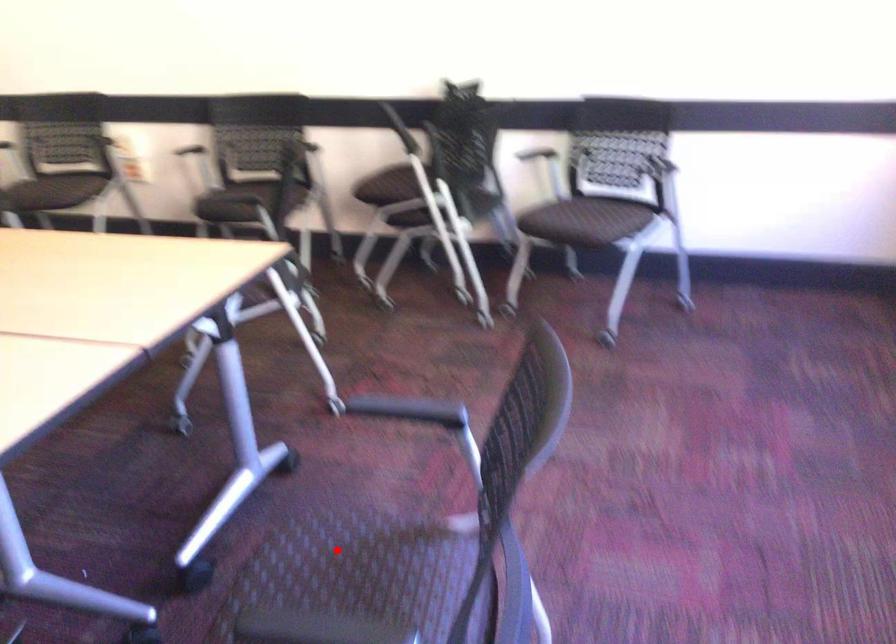
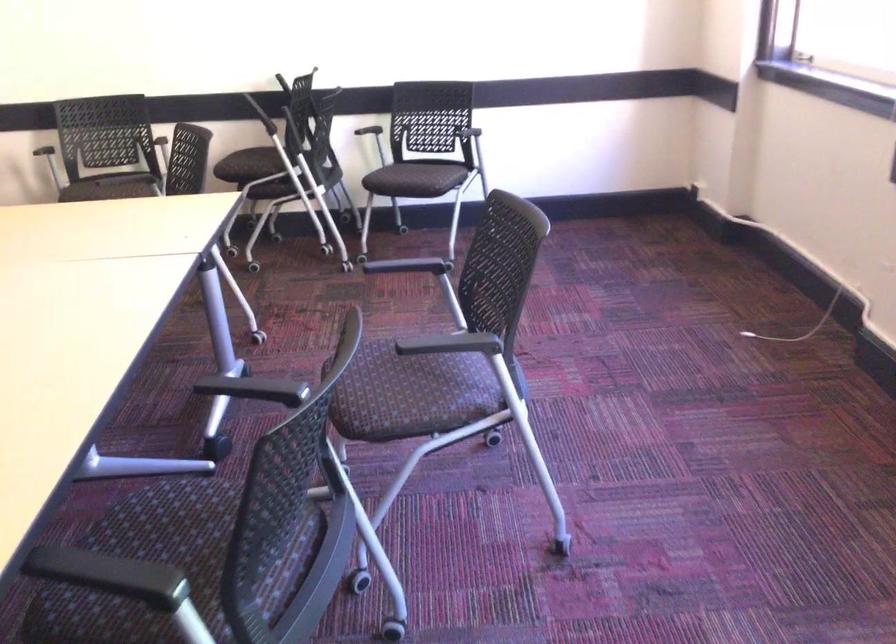
Question: A red point is marked in image1. In image2, is the corresponding 3D point closer to the camera or farther? Reply with the corresponding letter.

Choices:
 (A) The corresponding 3D point is closer.
 (B) The corresponding 3D point is farther.

Answer: (B)